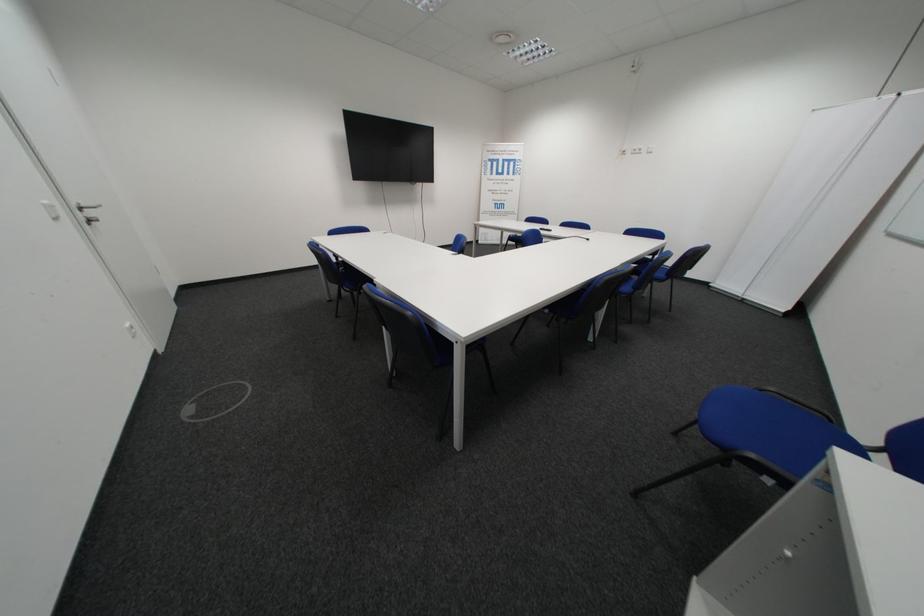
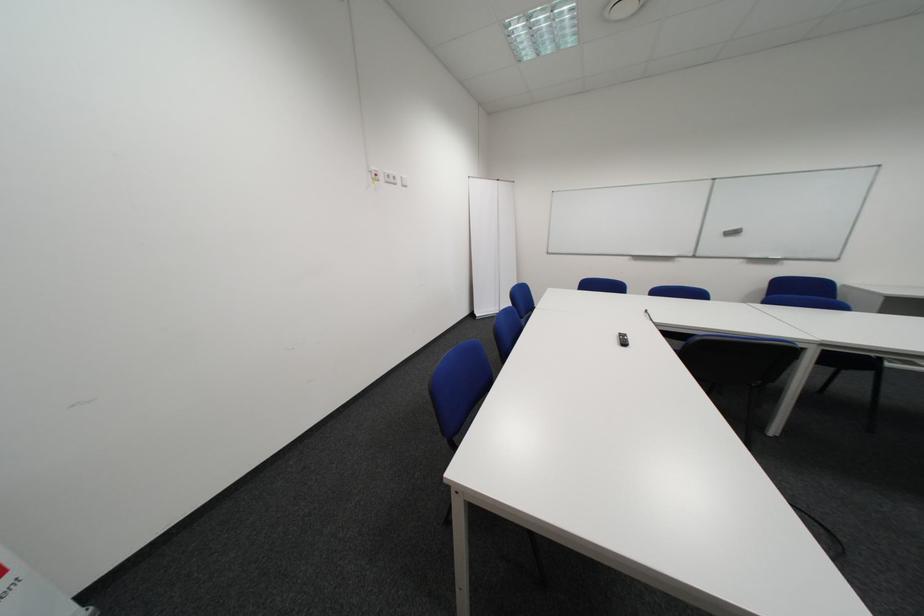
Locate, in the second image, the point that corresponds to (x=646, y=153) in the first image.

(398, 180)